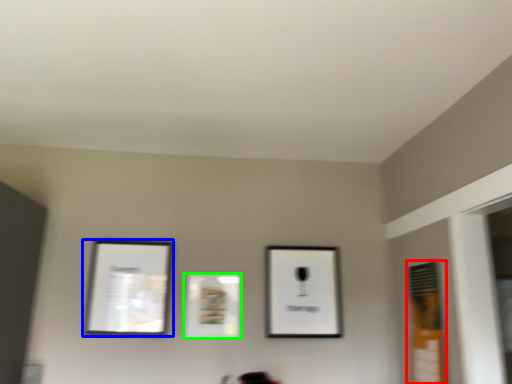
Question: Which is farther away from window (highlighted by a red box)? picture frame (highlighted by a blue box) or picture frame (highlighted by a green box)?

Choices:
 (A) picture frame
 (B) picture frame

Answer: (A)